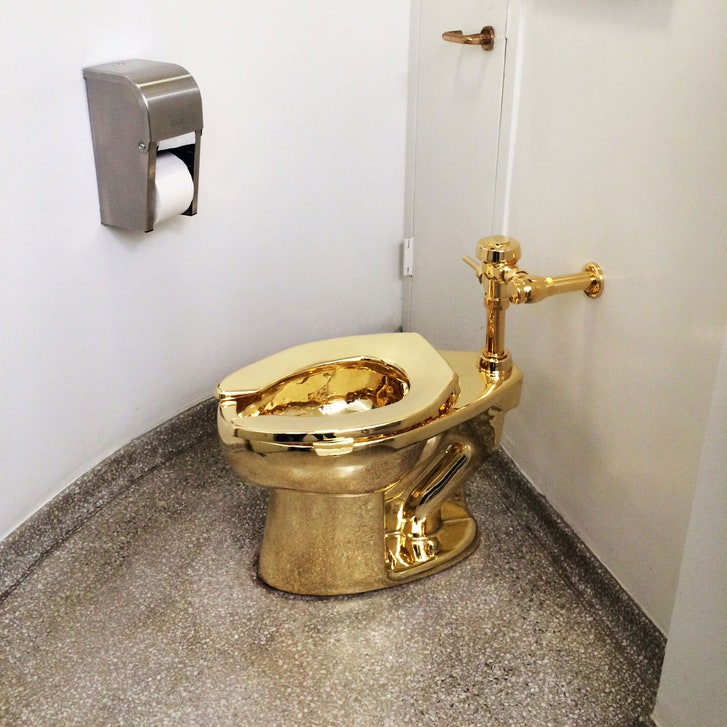
This screenshot has width=727, height=727. Identify the location of floor. (411, 691).